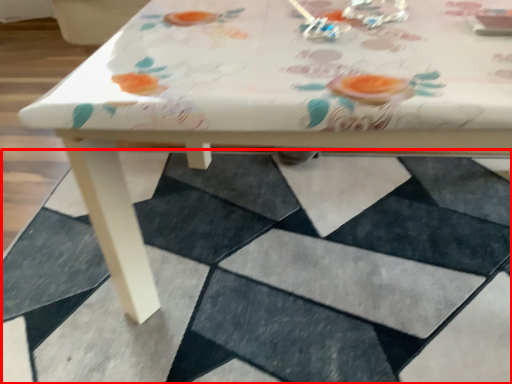
Question: From the image's perspective, where is square (annotated by the red box) located in relation to tableware in the image?

Choices:
 (A) above
 (B) below

Answer: (B)